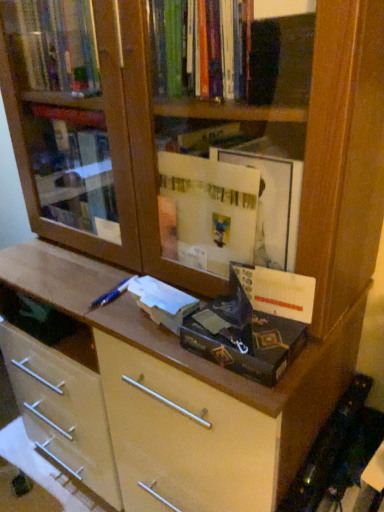
Question: Which direction should I rotate to look at matte cardboard paperback book at center, the 2th paperback book viewed from the left, — up or down?

Choices:
 (A) up
 (B) down

Answer: (B)

Question: Should I look upward or downward to see white matte paper at center, which appears as the first paperback book when viewed from the left?

Choices:
 (A) up
 (B) down

Answer: (B)

Question: Does matte cardboard paperback book at center, arranged as the 1th paperback book when viewed from the right, contain white matte paper at center, the second paperback book positioned from the right?

Choices:
 (A) yes
 (B) no

Answer: (B)

Question: Does matte cardboard paperback book at center, arranged as the 1th paperback book when viewed from the right, come behind white matte paper at center, which appears as the first paperback book when viewed from the left?

Choices:
 (A) yes
 (B) no

Answer: (B)

Question: From the image's perspective, does matte cardboard paperback book at center, arranged as the 1th paperback book when viewed from the right, appear higher than white matte paper at center, which appears as the first paperback book when viewed from the left?

Choices:
 (A) yes
 (B) no

Answer: (A)

Question: Considering the relative sizes of matte cardboard paperback book at center, arranged as the 1th paperback book when viewed from the right, and white matte paper at center, the second paperback book positioned from the right, in the image provided, is matte cardboard paperback book at center, arranged as the 1th paperback book when viewed from the right, wider than white matte paper at center, the second paperback book positioned from the right,?

Choices:
 (A) yes
 (B) no

Answer: (A)

Question: Is matte cardboard paperback book at center, the 2th paperback book viewed from the left, beside white matte paper at center, which appears as the first paperback book when viewed from the left?

Choices:
 (A) no
 (B) yes

Answer: (A)

Question: Is matte cardboard paperback book at center, the 2th paperback book viewed from the left, to the left of white matte paper at center, the second paperback book positioned from the right, from the viewer's perspective?

Choices:
 (A) yes
 (B) no

Answer: (B)

Question: Would you say matte cardboard paperback book at center, the 2th paperback book viewed from the left, is part of white matte paper at center, the second paperback book positioned from the right,'s contents?

Choices:
 (A) yes
 (B) no

Answer: (B)

Question: Does white matte paper at center, the second paperback book positioned from the right, appear on the right side of matte cardboard paperback book at center, the 2th paperback book viewed from the left?

Choices:
 (A) no
 (B) yes

Answer: (A)

Question: Are white matte paper at center, the second paperback book positioned from the right, and matte cardboard paperback book at center, arranged as the 1th paperback book when viewed from the right, far apart?

Choices:
 (A) yes
 (B) no

Answer: (B)

Question: Is white matte paper at center, which appears as the first paperback book when viewed from the left, shorter than matte cardboard paperback book at center, the 2th paperback book viewed from the left?

Choices:
 (A) no
 (B) yes

Answer: (B)

Question: Can you confirm if white matte paper at center, the second paperback book positioned from the right, is taller than matte cardboard paperback book at center, arranged as the 1th paperback book when viewed from the right?

Choices:
 (A) yes
 (B) no

Answer: (B)

Question: Considering the relative sizes of white matte paper at center, the second paperback book positioned from the right, and matte cardboard paperback book at center, the 2th paperback book viewed from the left, in the image provided, is white matte paper at center, the second paperback book positioned from the right, bigger than matte cardboard paperback book at center, the 2th paperback book viewed from the left,?

Choices:
 (A) yes
 (B) no

Answer: (B)

Question: Is point (132, 289) positioned closer to the camera than point (188, 342)?

Choices:
 (A) closer
 (B) farther

Answer: (B)